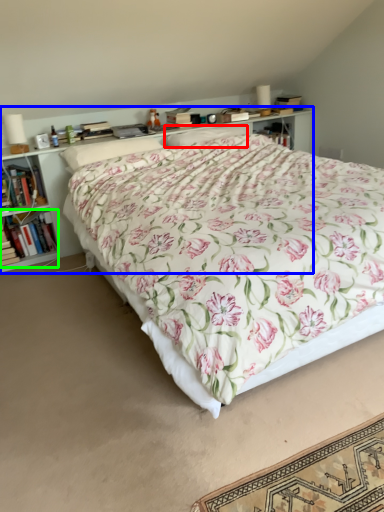
Question: Based on their relative distances, which object is farther from pillow (highlighted by a red box)? Choose from shelf (highlighted by a blue box) and book (highlighted by a green box).

Choices:
 (A) shelf
 (B) book

Answer: (B)